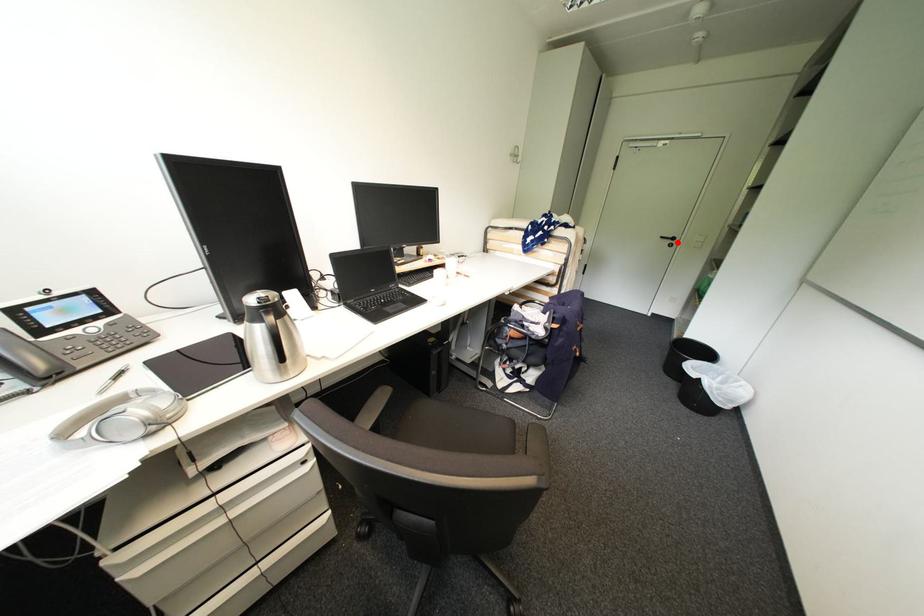
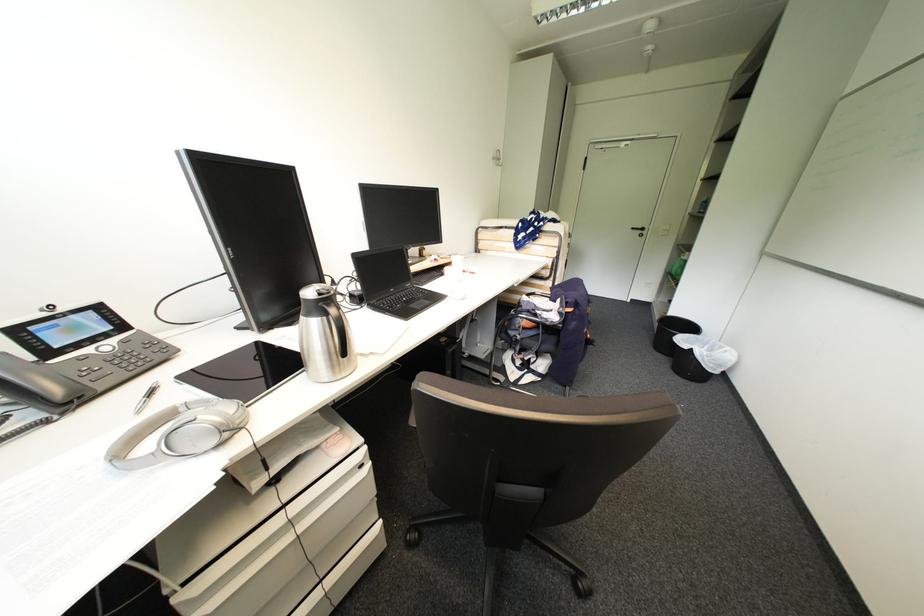
Question: I am providing you with two images of the same scene from different viewpoints. A red point is marked on the first image. Can you still see the location of the red point in image 2?

Choices:
 (A) Yes
 (B) No

Answer: (A)